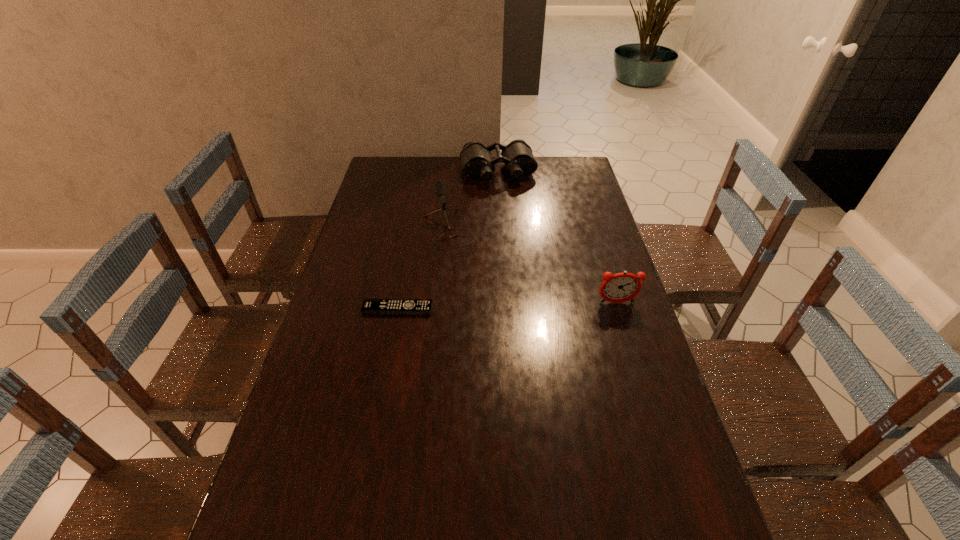
Identify the location of empty location between the shortest object and the binoculars. (447, 240).

Locate an element on the screen. Image resolution: width=960 pixels, height=540 pixels. the third closest object to the second farthest object is located at coordinates (621, 287).

Select which object appears as the third closest to the second farthest object. Please provide its 2D coordinates. Your answer should be formatted as a tuple, i.e. [(x, y)], where the tuple contains the x and y coordinates of a point satisfying the conditions above.

[(621, 287)]

The height and width of the screenshot is (540, 960). Identify the location of vacant space that satisfies the following two spatial constraints: 1. on the back side of the shortest object; 2. on the right side of the microphone. [x=413, y=229].